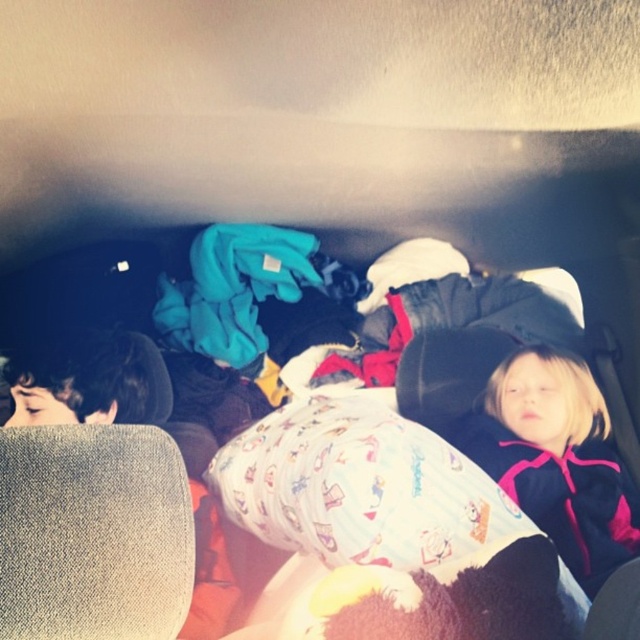
Is point (490, 292) more distant than point (42, 369)?

Yes, it is behind point (42, 369).

Is white cotton bed at center to the left of dark brown hair at left from the viewer's perspective?

In fact, white cotton bed at center is to the right of dark brown hair at left.

Image resolution: width=640 pixels, height=640 pixels. In order to click on white cotton bed at center in this screenshot , I will do `click(240, 289)`.

Image resolution: width=640 pixels, height=640 pixels. I want to click on white cotton bed at center, so click(x=240, y=289).

Consider the image. How much distance is there between white cotton bed at center and pink fleece jacket at right?

white cotton bed at center is 49.44 centimeters away from pink fleece jacket at right.

Can you confirm if white cotton bed at center is positioned to the left of pink fleece jacket at right?

Correct, you'll find white cotton bed at center to the left of pink fleece jacket at right.

Is point (371, 284) closer to camera compared to point (524, 445)?

No, (371, 284) is behind (524, 445).

The width and height of the screenshot is (640, 640). Find the location of `white cotton bed at center`. white cotton bed at center is located at coordinates (240, 289).

Is point (611, 554) positioned in front of point (20, 394)?

That is True.

Where is `pink fleece jacket at right`? Image resolution: width=640 pixels, height=640 pixels. pink fleece jacket at right is located at coordinates (561, 493).

Who is more distant from viewer, [512,456] or [115,332]?

Positioned behind is point [115,332].

Locate an element on the screen. pink fleece jacket at right is located at coordinates (561, 493).